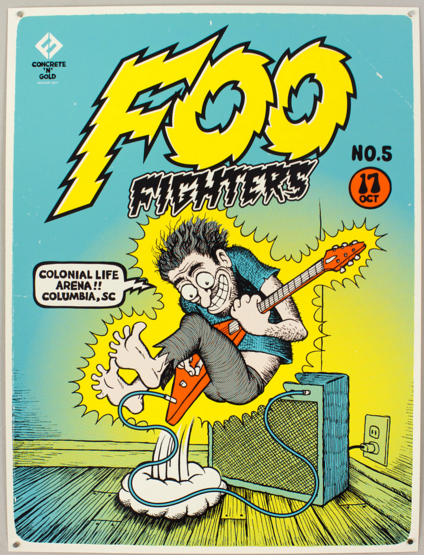
This screenshot has height=555, width=424. Find the location of `outlet`. outlet is located at coordinates (384, 445).